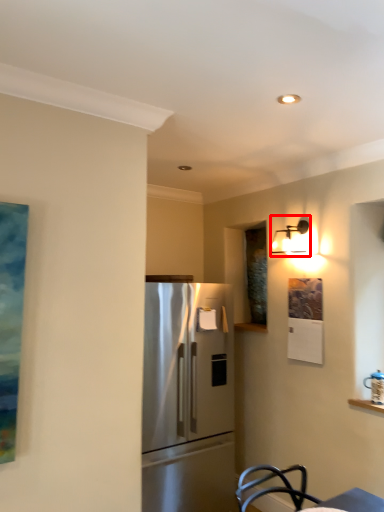
Question: From the image, what is the correct spatial relationship of light fixture (annotated by the red box) in relation to refrigerator?

Choices:
 (A) right
 (B) left

Answer: (A)